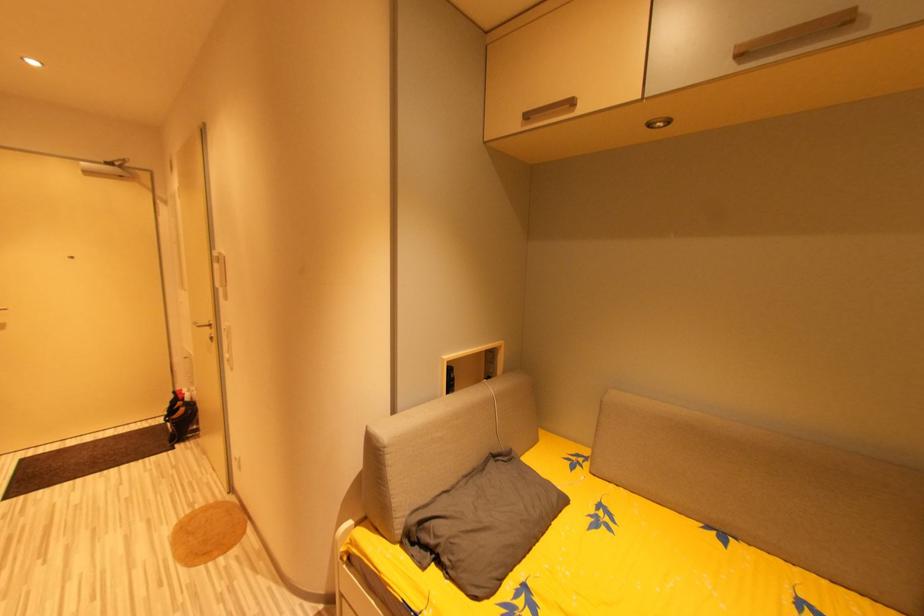
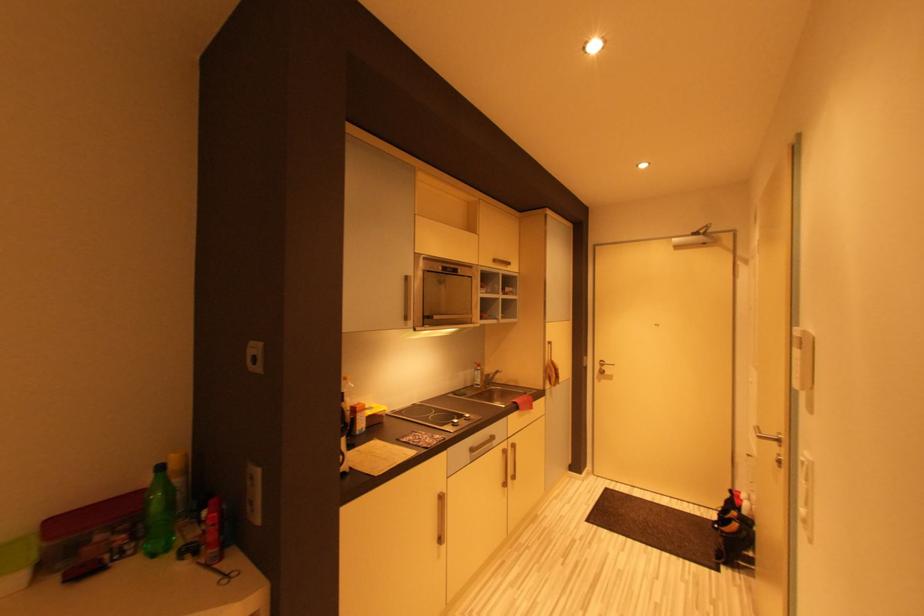
Question: The camera is either moving clockwise (left) or counter-clockwise (right) around the object. The first image is from the beginning of the video and the second image is from the end. Is the camera moving left or right when shooting the video?

Choices:
 (A) Left
 (B) Right

Answer: (B)